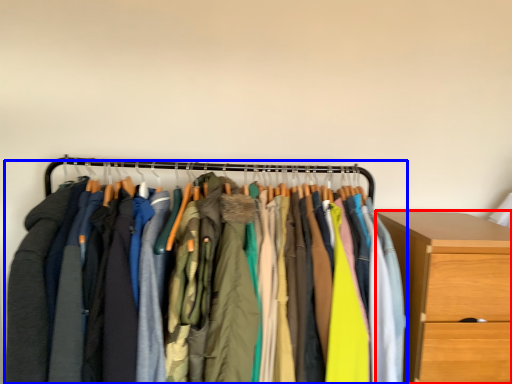
Question: Which object is closer to the camera taking this photo, chest of drawers (highlighted by a red box) or closet (highlighted by a blue box)?

Choices:
 (A) chest of drawers
 (B) closet

Answer: (B)